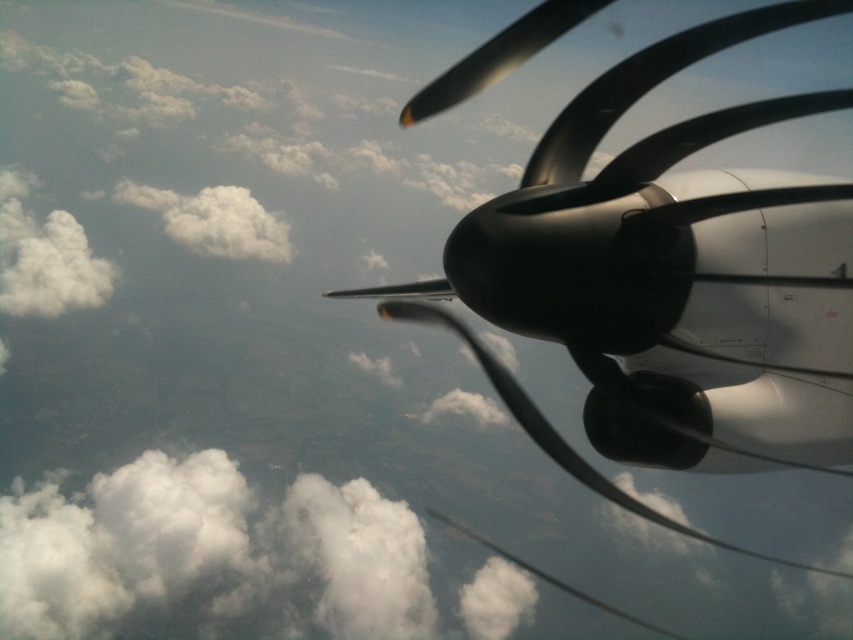
Which is more to the right, white fluffy cloud at upper left or white fluffy cloud at upper center?

white fluffy cloud at upper center

Is white fluffy cloud at upper left below white fluffy cloud at upper center?

Yes, white fluffy cloud at upper left is below white fluffy cloud at upper center.

In order to click on white fluffy cloud at upper left in this screenshot , I will do `click(45, 257)`.

Is polished metallic propeller at upper right smaller than white fluffy cloud at upper left?

Incorrect, polished metallic propeller at upper right is not smaller in size than white fluffy cloud at upper left.

Can you confirm if polished metallic propeller at upper right is positioned to the left of white fluffy cloud at upper left?

No, polished metallic propeller at upper right is not to the left of white fluffy cloud at upper left.

This screenshot has height=640, width=853. Describe the element at coordinates (677, 273) in the screenshot. I see `polished metallic propeller at upper right` at that location.

In order to click on polished metallic propeller at upper right in this screenshot , I will do `click(677, 273)`.

Does polished metallic propeller at upper right appear on the left side of white fluffy cloud at upper center?

No, polished metallic propeller at upper right is not to the left of white fluffy cloud at upper center.

Is the position of polished metallic propeller at upper right less distant than that of white fluffy cloud at upper center?

That is True.

What do you see at coordinates (677, 273) in the screenshot?
I see `polished metallic propeller at upper right` at bounding box center [677, 273].

You are a GUI agent. You are given a task and a screenshot of the screen. Output one action in this format:
    pyautogui.click(x=<x>, y=<y>)
    Task: Click on the polished metallic propeller at upper right
    The image size is (853, 640).
    Given the screenshot: What is the action you would take?
    pyautogui.click(x=677, y=273)